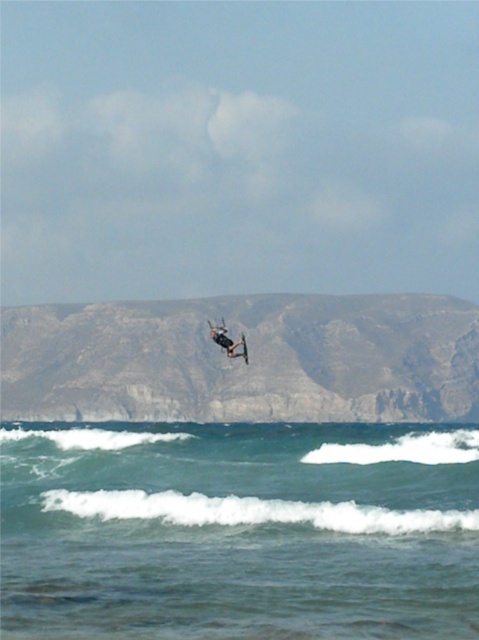
Can you confirm if blue water at center is positioned below smooth black surfboard at center?

Correct, blue water at center is located below smooth black surfboard at center.

Can you confirm if blue water at center is smaller than smooth black surfboard at center?

No.

You are a GUI agent. You are given a task and a screenshot of the screen. Output one action in this format:
    pyautogui.click(x=<x>, y=<y>)
    Task: Click on the blue water at center
    
    Given the screenshot: What is the action you would take?
    pyautogui.click(x=239, y=531)

Does blue water at center lie behind black matte surfboard at center?

No, it is not.

Find the location of a particular element. blue water at center is located at coordinates (239, 531).

Which is behind, point (189, 465) or point (216, 332)?

Point (216, 332)

Where is `blue water at center`? The image size is (479, 640). blue water at center is located at coordinates (239, 531).

Can you confirm if black matte surfboard at center is bigger than smooth black surfboard at center?

Yes, black matte surfboard at center is bigger than smooth black surfboard at center.

Can you confirm if black matte surfboard at center is positioned to the left of smooth black surfboard at center?

Yes, black matte surfboard at center is to the left of smooth black surfboard at center.

Describe the element at coordinates (227, 340) in the screenshot. I see `black matte surfboard at center` at that location.

You are a GUI agent. You are given a task and a screenshot of the screen. Output one action in this format:
    pyautogui.click(x=<x>, y=<y>)
    Task: Click on the black matte surfboard at center
    Image resolution: width=479 pixels, height=640 pixels.
    Given the screenshot: What is the action you would take?
    pyautogui.click(x=227, y=340)